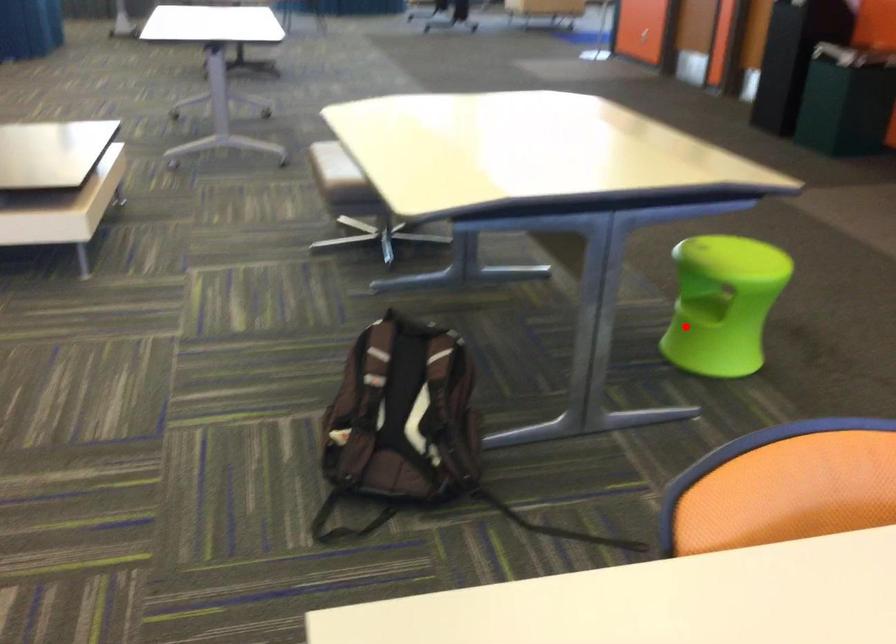
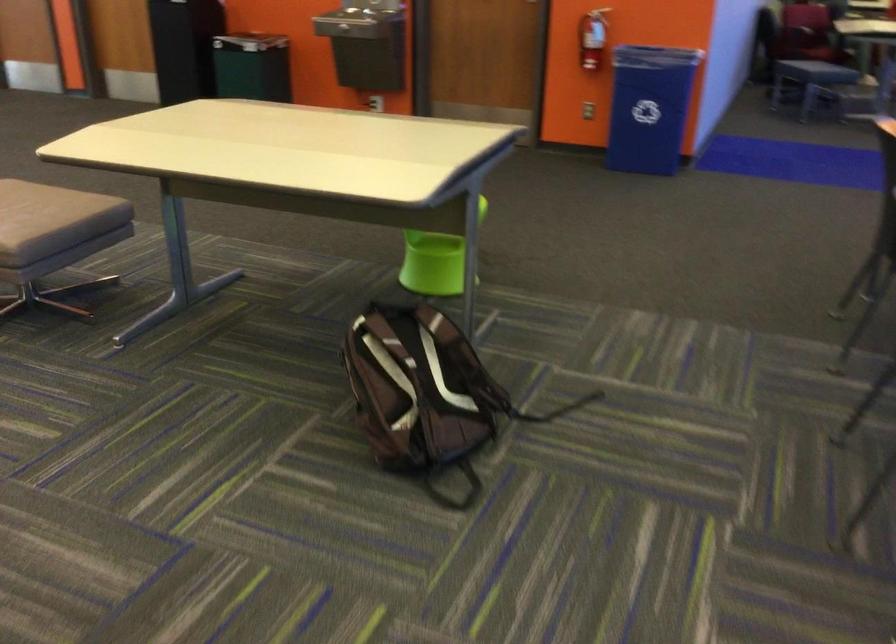
Locate, in the second image, the point that corresponds to the highlighted location in the first image.

(435, 261)